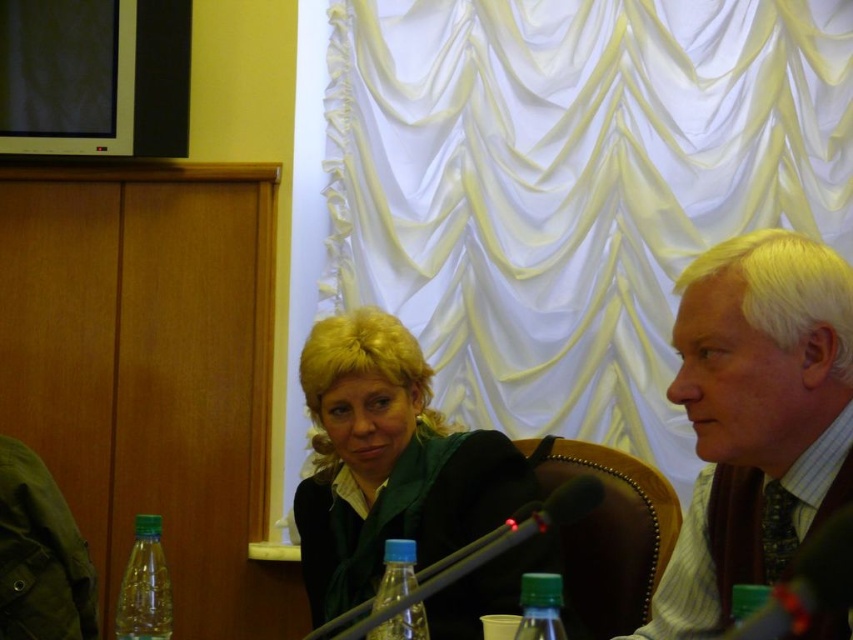
Question: Which object appears farthest from the camera in this image?

Choices:
 (A) green plastic bottle at center
 (B) matte black monitor at upper left
 (C) matte green scarf at center

Answer: (B)

Question: Considering the relative positions of white striped shirt at center and matte green scarf at center in the image provided, where is white striped shirt at center located with respect to matte green scarf at center?

Choices:
 (A) left
 (B) right

Answer: (B)

Question: Which of the following is the farthest from the observer?

Choices:
 (A) (380, 609)
 (B) (173, 136)

Answer: (B)

Question: Which object appears farthest from the camera in this image?

Choices:
 (A) green plastic bottle at center
 (B) green plastic bottle at lower left
 (C) blue plastic bottle at center
 (D) white satin curtain at upper center

Answer: (D)

Question: Does white satin curtain at upper center have a lesser width compared to matte black monitor at upper left?

Choices:
 (A) yes
 (B) no

Answer: (B)

Question: Can you confirm if white satin curtain at upper center is bigger than green plastic bottle at lower left?

Choices:
 (A) no
 (B) yes

Answer: (B)